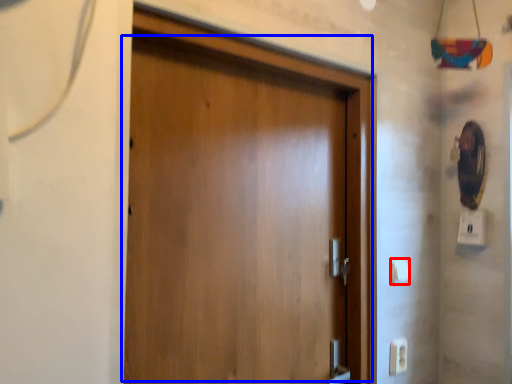
Question: Which object appears farthest to the camera in this image, light switch (highlighted by a red box) or door (highlighted by a blue box)?

Choices:
 (A) light switch
 (B) door

Answer: (A)